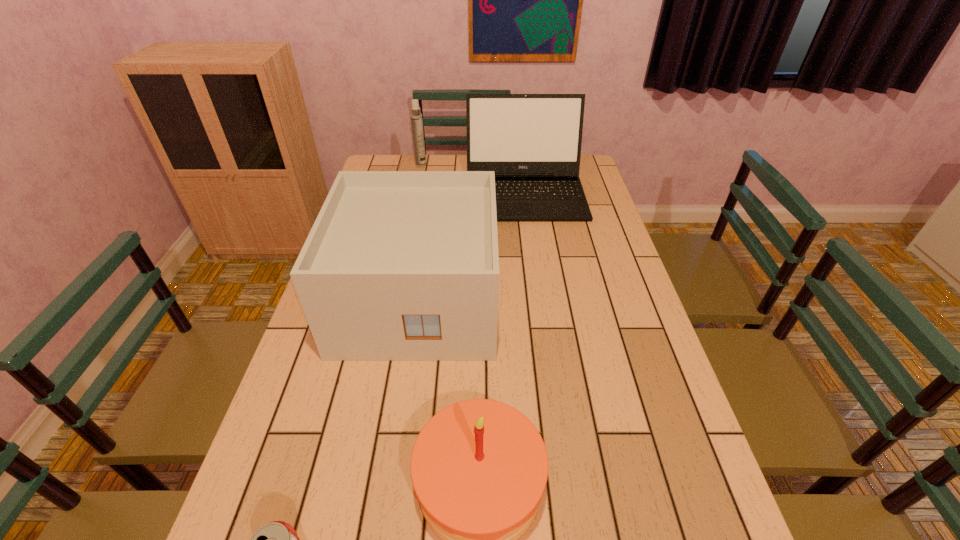
The image size is (960, 540). In order to click on laptop in this screenshot , I will do `click(532, 142)`.

Where is `box`? The height and width of the screenshot is (540, 960). box is located at coordinates (399, 265).

At what (x,y) coordinates should I click in order to perform the action: click on the farthest object. Please return your answer as a coordinate pair (x, y). Image resolution: width=960 pixels, height=540 pixels. Looking at the image, I should click on (416, 117).

This screenshot has width=960, height=540. In order to click on vacant space located on the surface of the fourth nearest object in this screenshot , I will do `click(530, 235)`.

Where is `free space located on the side of the third nearest object with the window`? The width and height of the screenshot is (960, 540). free space located on the side of the third nearest object with the window is located at coordinates (399, 424).

The height and width of the screenshot is (540, 960). Identify the location of free space located on the right of the farthest object. (455, 165).

The width and height of the screenshot is (960, 540). I want to click on laptop that is at the far edge, so click(532, 142).

Find the location of a particular element. The image size is (960, 540). aerosol can situated at the far edge is located at coordinates (416, 117).

Image resolution: width=960 pixels, height=540 pixels. I want to click on object that is positioned at the left edge, so 399,265.

This screenshot has height=540, width=960. In order to click on object located in the right edge section of the desktop in this screenshot , I will do `click(532, 142)`.